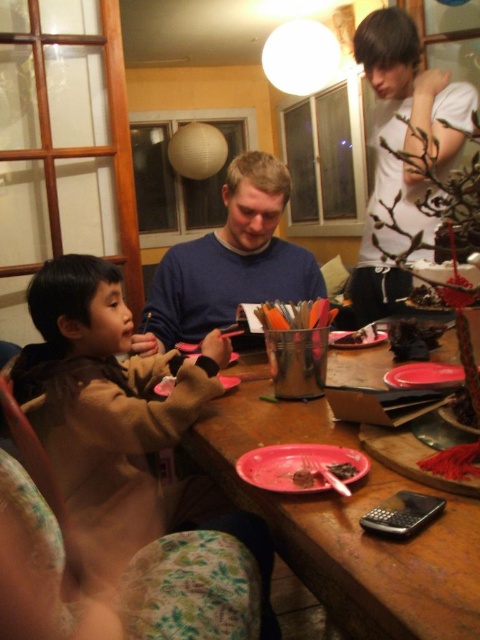
Is brown fuzzy jacket at left below smooth plastic fork at center?

Yes, brown fuzzy jacket at left is below smooth plastic fork at center.

The width and height of the screenshot is (480, 640). What are the coordinates of `brown fuzzy jacket at left` in the screenshot? It's located at (105, 392).

Which of these two, wooden table at center or pink matte plastic fork at lower center, stands shorter?

pink matte plastic fork at lower center is shorter.

Is wooden table at center to the right of pink matte plastic fork at lower center from the viewer's perspective?

Correct, you'll find wooden table at center to the right of pink matte plastic fork at lower center.

Does point (399, 579) come behind point (304, 468)?

No.

The height and width of the screenshot is (640, 480). Identify the location of wooden table at center. (347, 522).

Who is higher up, wooden table at center or pink plastic plate at lower center?

wooden table at center

Does wooden table at center have a greater width compared to pink plastic plate at lower center?

Yes.

Is point (400, 589) less distant than point (300, 454)?

Yes.

The image size is (480, 640). Identify the location of wooden table at center. (347, 522).